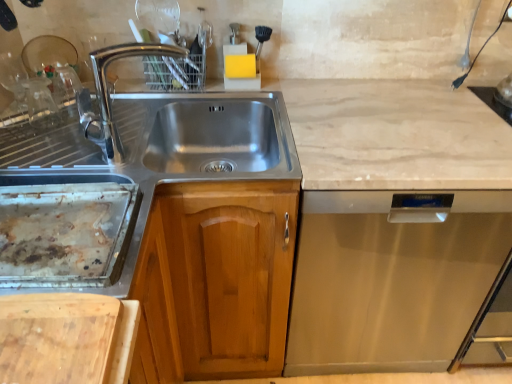
Find the location of a particular element. This screenshot has height=384, width=512. free space above stainless steel dishwasher at right (from a real-world perspective) is located at coordinates (407, 120).